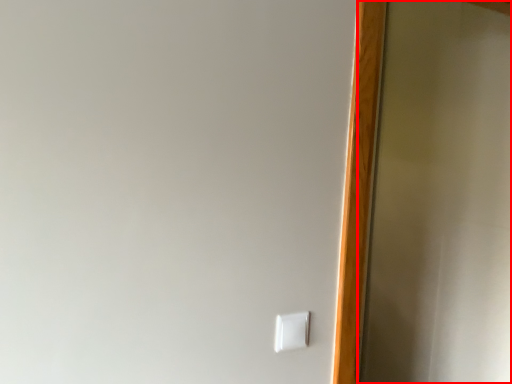
Question: From the image's perspective, where is screen door (annotated by the red box) located in relation to light switch in the image?

Choices:
 (A) below
 (B) above

Answer: (B)